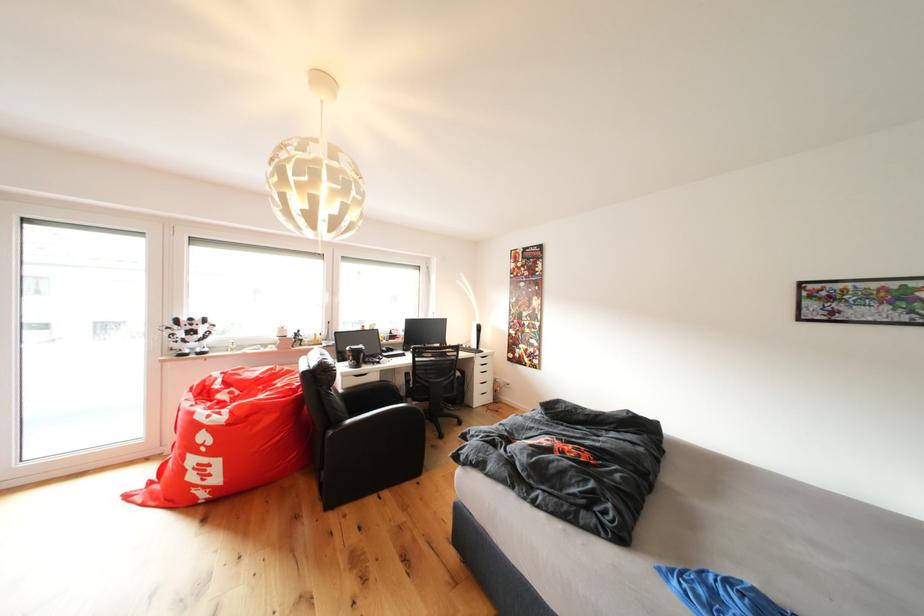
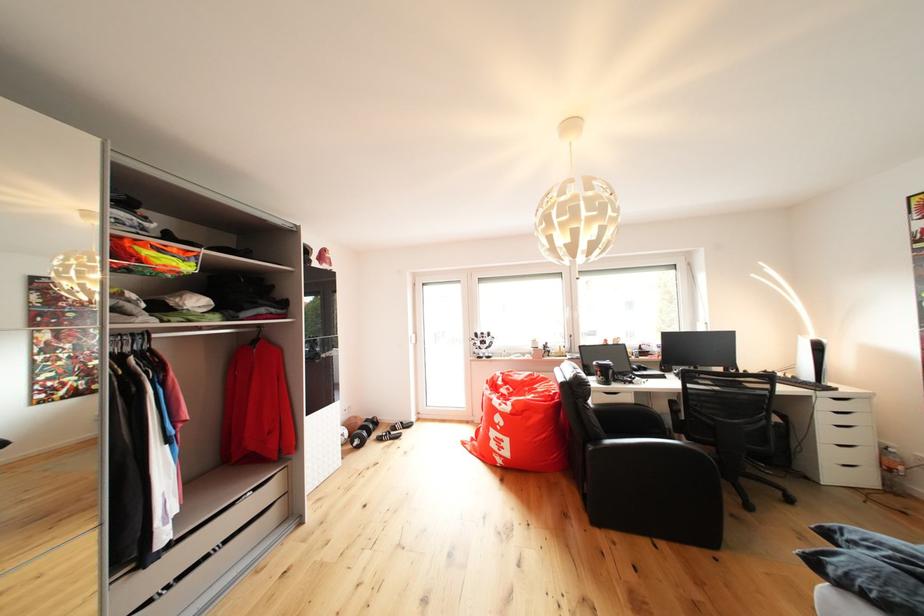
Find the pixel in the second image that matches point 492,366 in the first image.

(850, 411)